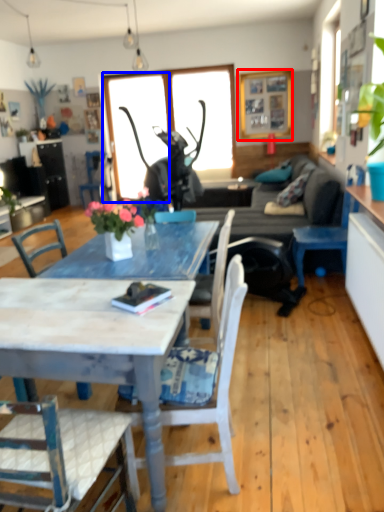
Question: Which object appears farthest to the camera in this image, picture frame (highlighted by a red box) or window screen (highlighted by a blue box)?

Choices:
 (A) picture frame
 (B) window screen

Answer: (B)